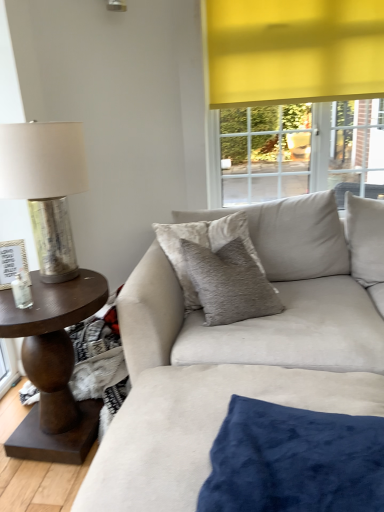
Question: Which direction should I rotate to look at velvet blue pillow at lower center, which appears as the first pillow when ordered from the bottom, — up or down?

Choices:
 (A) up
 (B) down

Answer: (B)

Question: From the image's perspective, is metallic silver table lamp at left on velvet blue pillow at lower center, the second pillow in the back-to-front sequence?

Choices:
 (A) yes
 (B) no

Answer: (A)

Question: Does metallic silver table lamp at left contain velvet blue pillow at lower center, the second pillow when ordered from top to bottom?

Choices:
 (A) no
 (B) yes

Answer: (A)

Question: Considering the relative positions of metallic silver table lamp at left and velvet blue pillow at lower center, the second pillow when ordered from top to bottom, in the image provided, is metallic silver table lamp at left to the left of velvet blue pillow at lower center, the second pillow when ordered from top to bottom, from the viewer's perspective?

Choices:
 (A) no
 (B) yes

Answer: (B)

Question: Can you confirm if metallic silver table lamp at left is wider than velvet blue pillow at lower center, which appears as the first pillow when ordered from the bottom?

Choices:
 (A) no
 (B) yes

Answer: (A)

Question: From a real-world perspective, does metallic silver table lamp at left sit lower than velvet blue pillow at lower center, the 1th pillow positioned from the front?

Choices:
 (A) yes
 (B) no

Answer: (B)

Question: Does metallic silver table lamp at left appear on the right side of velvet blue pillow at lower center, the 1th pillow positioned from the front?

Choices:
 (A) no
 (B) yes

Answer: (A)

Question: Does suede couch at center turn towards metallic silver table lamp at left?

Choices:
 (A) no
 (B) yes

Answer: (A)

Question: From a real-world perspective, is suede couch at center below metallic silver table lamp at left?

Choices:
 (A) no
 (B) yes

Answer: (B)

Question: Is suede couch at center located outside metallic silver table lamp at left?

Choices:
 (A) no
 (B) yes

Answer: (B)

Question: Could metallic silver table lamp at left be considered to be inside suede couch at center?

Choices:
 (A) yes
 (B) no

Answer: (B)

Question: Can you confirm if suede couch at center is positioned to the left of metallic silver table lamp at left?

Choices:
 (A) no
 (B) yes

Answer: (A)

Question: Would you consider suede couch at center to be distant from metallic silver table lamp at left?

Choices:
 (A) no
 (B) yes

Answer: (A)

Question: Is velvet blue pillow at lower center, the second pillow in the back-to-front sequence, next to dark brown wood side table at left?

Choices:
 (A) no
 (B) yes

Answer: (A)